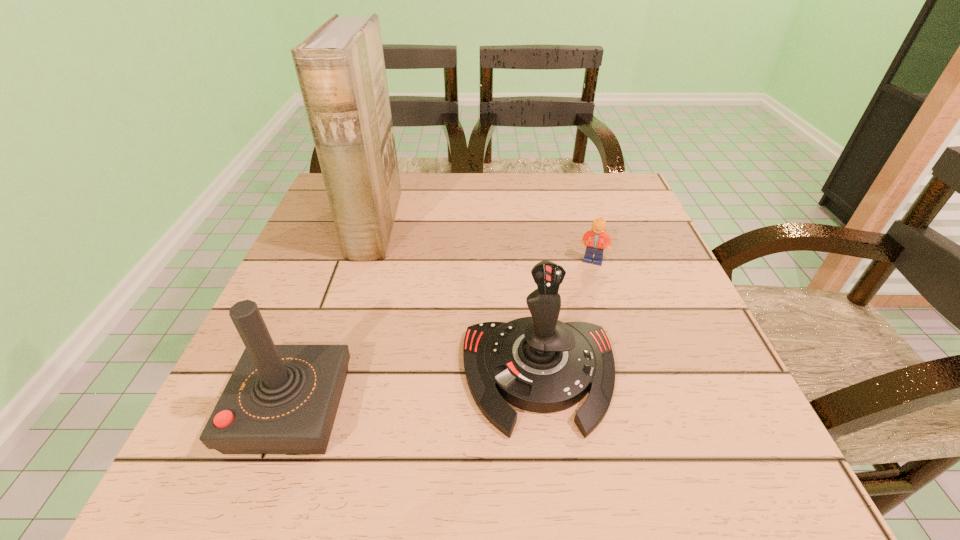
Locate an element on the screen. vacant area that lies between the shortest object and the left joystick is located at coordinates (442, 335).

This screenshot has height=540, width=960. I want to click on vacant space that is in between the Lego and the phonebook, so click(x=484, y=244).

I want to click on empty space between the right joystick and the shortest object, so click(x=566, y=318).

The height and width of the screenshot is (540, 960). In order to click on unoccupied position between the right joystick and the phonebook in this screenshot , I will do `click(457, 301)`.

The image size is (960, 540). What are the coordinates of `unoccupied area between the Lego and the phonebook` in the screenshot? It's located at (484, 244).

Locate an element on the screen. Image resolution: width=960 pixels, height=540 pixels. vacant point located between the shortest object and the tallest object is located at coordinates (484, 244).

At what (x,y) coordinates should I click in order to perform the action: click on vacant space that is in between the left joystick and the right joystick. Please return your answer as a coordinate pair (x, y). Image resolution: width=960 pixels, height=540 pixels. Looking at the image, I should click on (415, 392).

Image resolution: width=960 pixels, height=540 pixels. I want to click on free space that is in between the right joystick and the phonebook, so click(457, 301).

At what (x,y) coordinates should I click in order to perform the action: click on vacant area that lies between the phonebook and the left joystick. Please return your answer as a coordinate pair (x, y). The height and width of the screenshot is (540, 960). Looking at the image, I should click on (333, 318).

Image resolution: width=960 pixels, height=540 pixels. Find the location of `object that can be found as the second closest to the tallest object`. object that can be found as the second closest to the tallest object is located at coordinates coord(280,399).